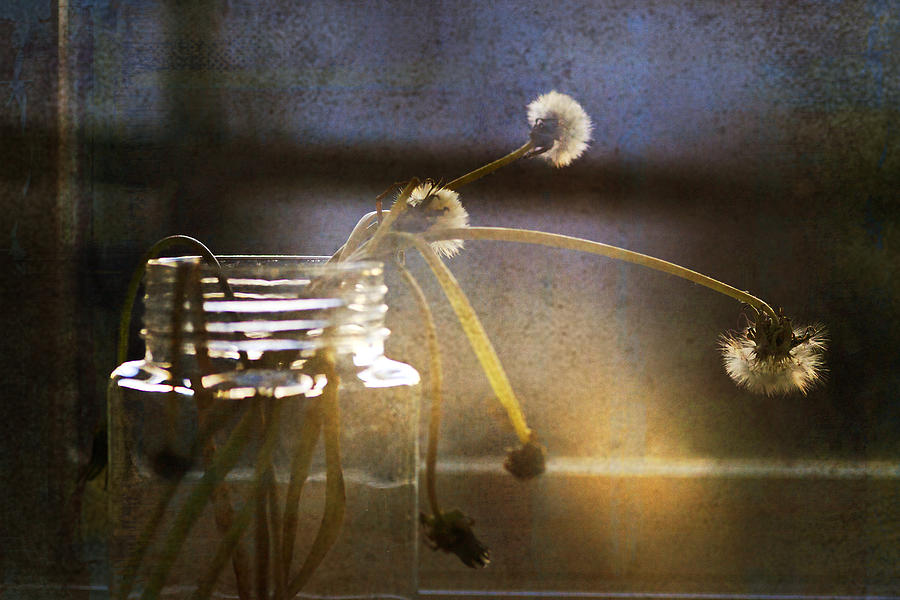
Identify the location of panel. The width and height of the screenshot is (900, 600). (70, 130).